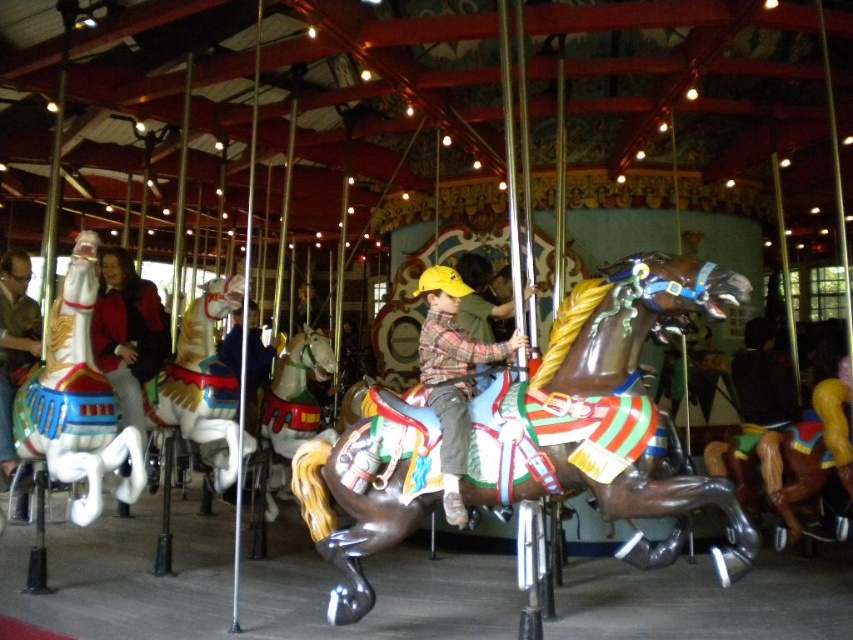
Question: Does white glossy horse at left appear over shiny gold horse at center?

Choices:
 (A) no
 (B) yes

Answer: (B)

Question: Which object is closer to the camera taking this photo?

Choices:
 (A) plaid fabric shirt at center
 (B) brushed metal water at bottle left
 (C) shiny brown horse at center

Answer: (C)

Question: Is shiny brown horse at center further to camera compared to matte black jacket at left?

Choices:
 (A) no
 (B) yes

Answer: (A)

Question: Which of these objects is positioned closest to the shiny gold horse at center?

Choices:
 (A) white glossy horse at left
 (B) matte black jacket at left
 (C) shiny brown horse at center

Answer: (B)

Question: Which point appears farthest from the camera in this image?

Choices:
 (A) (171, 413)
 (B) (640, 268)

Answer: (A)

Question: Is the position of matte black jacket at left less distant than that of brushed metal water at bottle left?

Choices:
 (A) yes
 (B) no

Answer: (A)